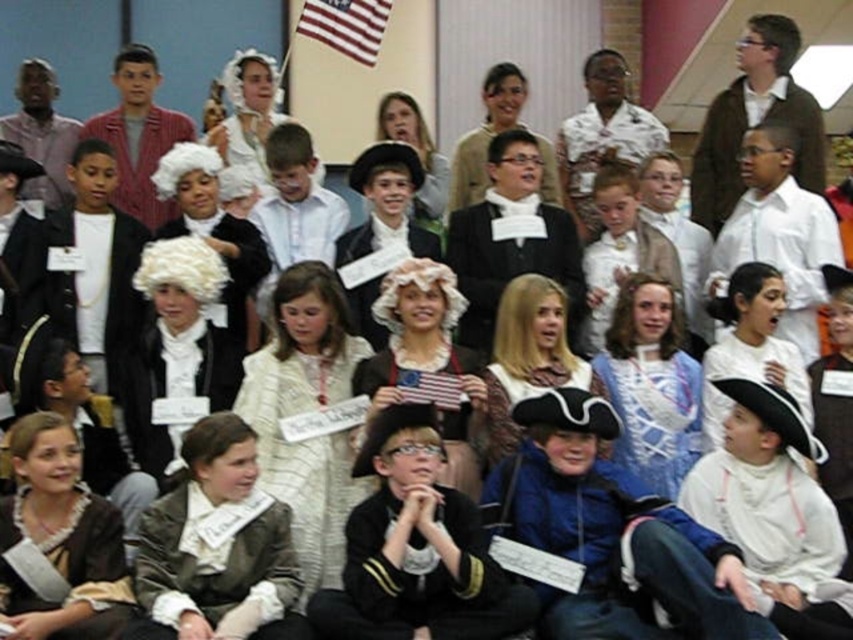
Question: Among these points, which one is nearest to the camera?

Choices:
 (A) click(316, 8)
 (B) click(335, 541)
 (C) click(425, 394)

Answer: (B)

Question: Where is matte brown jacket at center located in relation to white textured dress at center in the image?

Choices:
 (A) right
 (B) left

Answer: (B)

Question: Is matte brown jacket at center positioned before american flag at upper center?

Choices:
 (A) no
 (B) yes

Answer: (B)

Question: Is white textured dress at center smaller than american flag at upper center?

Choices:
 (A) yes
 (B) no

Answer: (B)

Question: Which of these objects is positioned farthest from the american flag at upper center?

Choices:
 (A) matte brown jacket at center
 (B) white textured dress at center

Answer: (A)

Question: Which point is farther to the camera?

Choices:
 (A) matte brown jacket at center
 (B) white textured dress at center
 (C) american flag at upper center

Answer: (C)